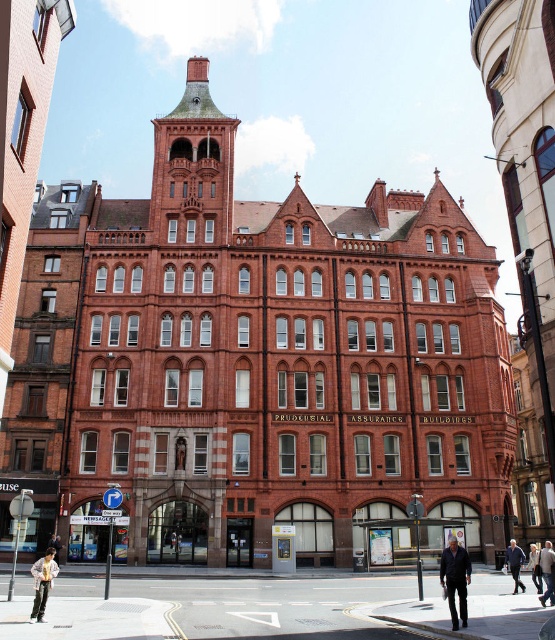
You are standing in front of the historic building and want to determine the relative positions of two points marked on its facade. The first point is located at coordinates point (513,566) and the second at point (528,561). Which of these two points is closer to your vantage point?

Point (513,566) is closer to the viewer than point (528,561).

You are standing in front of the historic building and notice a blue denim jacket at lower right. There is a point marked at coordinates (514,563). Is this point located on the blue denim jacket at lower right?

Yes, the point at coordinates (514,563) is located on the blue denim jacket at lower right according to the description.

You are a photographer planning to take a portrait of two jackets displayed on mannequins in front of the historic building. The blue denim jacket at lower right and the light beige fabric jacket at lower right are placed side by side. Which jacket should you position closer to the camera to ensure both appear balanced in size in the final photo?

You should position the blue denim jacket at lower right closer to the camera since it is smaller in size compared to the light beige fabric jacket at lower right, which will help balance their apparent sizes in the photograph.